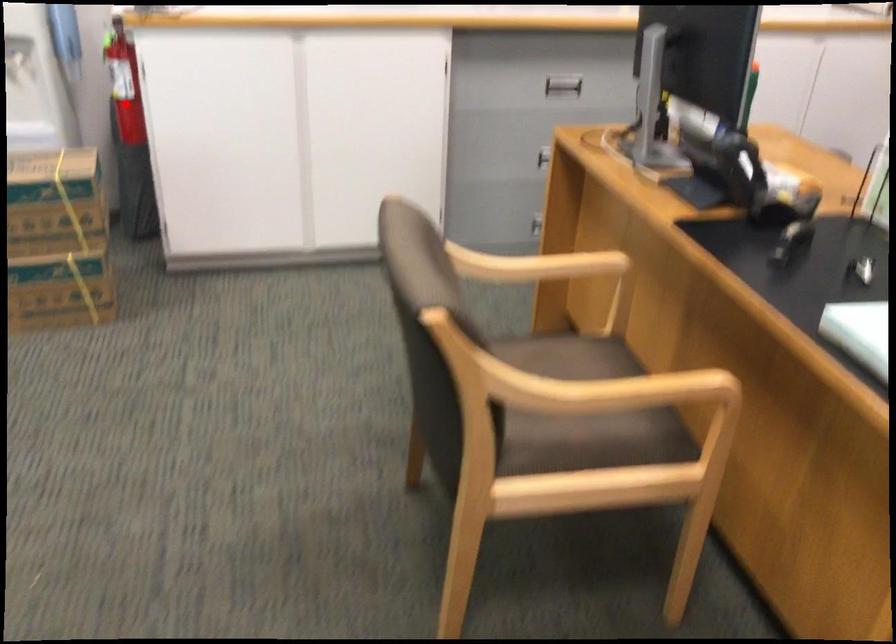
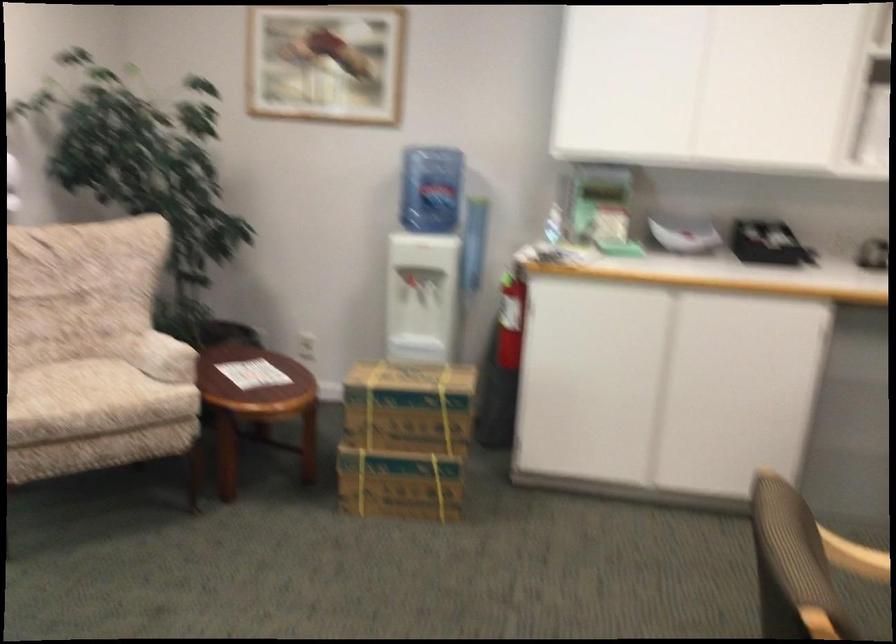
The point at the highlighted location is marked in the first image. Where is the corresponding point in the second image?

(510, 321)